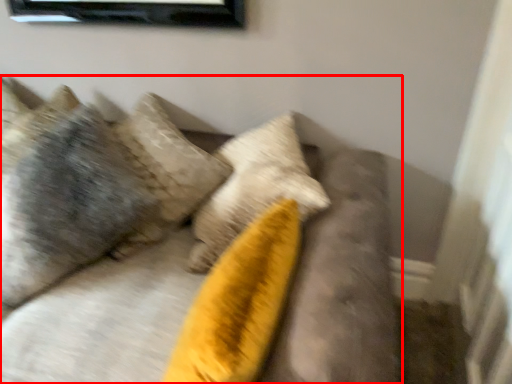
Question: Observing the image, what is the correct spatial positioning of furniture (annotated by the red box) in reference to pillow?

Choices:
 (A) right
 (B) left

Answer: (A)